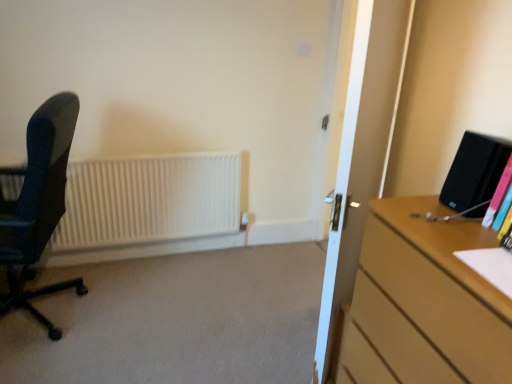
Question: Can you confirm if transparent glass door at center is bigger than multicolored plastic book at right?

Choices:
 (A) no
 (B) yes

Answer: (B)

Question: Is transparent glass door at center thinner than multicolored plastic book at right?

Choices:
 (A) no
 (B) yes

Answer: (A)

Question: Considering the relative positions of transparent glass door at center and multicolored plastic book at right in the image provided, is transparent glass door at center to the left of multicolored plastic book at right from the viewer's perspective?

Choices:
 (A) no
 (B) yes

Answer: (B)

Question: From a real-world perspective, is transparent glass door at center below multicolored plastic book at right?

Choices:
 (A) yes
 (B) no

Answer: (A)

Question: Is transparent glass door at center in front of multicolored plastic book at right?

Choices:
 (A) no
 (B) yes

Answer: (A)

Question: Considering their positions, is multicolored plastic book at right located in front of or behind matte black office chair at left?

Choices:
 (A) behind
 (B) front

Answer: (B)

Question: From their relative heights in the image, would you say multicolored plastic book at right is taller or shorter than matte black office chair at left?

Choices:
 (A) tall
 (B) short

Answer: (B)

Question: From a real-world perspective, is multicolored plastic book at right above or below matte black office chair at left?

Choices:
 (A) below
 (B) above

Answer: (B)

Question: Is multicolored plastic book at right bigger or smaller than matte black office chair at left?

Choices:
 (A) small
 (B) big

Answer: (A)

Question: In terms of size, does multicolored plastic book at right appear bigger or smaller than wooden desk at right?

Choices:
 (A) big
 (B) small

Answer: (B)

Question: Would you say multicolored plastic book at right is to the left or to the right of wooden desk at right in the picture?

Choices:
 (A) left
 (B) right

Answer: (B)

Question: From the image's perspective, relative to wooden desk at right, is multicolored plastic book at right above or below?

Choices:
 (A) above
 (B) below

Answer: (A)

Question: Considering the positions of multicolored plastic book at right and wooden desk at right in the image, is multicolored plastic book at right wider or thinner than wooden desk at right?

Choices:
 (A) thin
 (B) wide

Answer: (A)

Question: In terms of width, does matte black office chair at left look wider or thinner when compared to white matte radiator at left?

Choices:
 (A) wide
 (B) thin

Answer: (A)

Question: Is matte black office chair at left bigger or smaller than white matte radiator at left?

Choices:
 (A) small
 (B) big

Answer: (B)